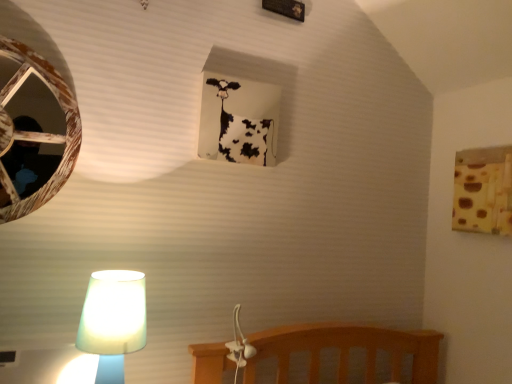
Question: Considering the relative sizes of wooden birdhouse at left and white paper at upper center, positioned as the 1th window frame in top-to-bottom order, in the image provided, is wooden birdhouse at left thinner than white paper at upper center, positioned as the 1th window frame in top-to-bottom order,?

Choices:
 (A) no
 (B) yes

Answer: (B)

Question: Does wooden birdhouse at left have a greater width compared to white paper at upper center, the second window frame from the right?

Choices:
 (A) no
 (B) yes

Answer: (A)

Question: Is wooden birdhouse at left located outside white paper at upper center, positioned as the 1th window frame in top-to-bottom order?

Choices:
 (A) yes
 (B) no

Answer: (A)

Question: From a real-world perspective, is wooden birdhouse at left positioned under white paper at upper center, the first window frame positioned from the left, based on gravity?

Choices:
 (A) yes
 (B) no

Answer: (A)

Question: From a real-world perspective, is wooden birdhouse at left physically above white paper at upper center, the first window frame positioned from the left?

Choices:
 (A) no
 (B) yes

Answer: (A)

Question: Looking at their shapes, would you say brown textured fabric at upper right, the first window frame positioned from the bottom, is wider or thinner than white paper at upper center, positioned as the 1th window frame in top-to-bottom order?

Choices:
 (A) wide
 (B) thin

Answer: (B)

Question: From their relative heights in the image, would you say brown textured fabric at upper right, the 2th window frame from the left, is taller or shorter than white paper at upper center, the first window frame positioned from the left?

Choices:
 (A) short
 (B) tall

Answer: (B)

Question: From the image's perspective, is brown textured fabric at upper right, the first window frame positioned from the bottom, above or below white paper at upper center, positioned as the 1th window frame in top-to-bottom order?

Choices:
 (A) below
 (B) above

Answer: (A)

Question: Considering the positions of point (506, 208) and point (251, 66), is point (506, 208) closer or farther from the camera than point (251, 66)?

Choices:
 (A) closer
 (B) farther

Answer: (A)

Question: In terms of width, does translucent glass lamp at lower left look wider or thinner when compared to white paper at upper center, positioned as the 1th window frame in top-to-bottom order?

Choices:
 (A) wide
 (B) thin

Answer: (A)

Question: Would you say translucent glass lamp at lower left is inside or outside white paper at upper center, positioned as the 1th window frame in top-to-bottom order?

Choices:
 (A) outside
 (B) inside

Answer: (A)

Question: In terms of height, does translucent glass lamp at lower left look taller or shorter compared to white paper at upper center, the second window frame from the right?

Choices:
 (A) tall
 (B) short

Answer: (B)

Question: Considering the positions of translucent glass lamp at lower left and white paper at upper center, the second window frame from the bottom, in the image, is translucent glass lamp at lower left bigger or smaller than white paper at upper center, the second window frame from the bottom,?

Choices:
 (A) big
 (B) small

Answer: (A)

Question: Considering the positions of point [266, 99] and point [35, 117], is point [266, 99] closer or farther from the camera than point [35, 117]?

Choices:
 (A) closer
 (B) farther

Answer: (A)

Question: In terms of height, does white paper at upper center, positioned as the 1th window frame in top-to-bottom order, look taller or shorter compared to wooden birdhouse at left?

Choices:
 (A) short
 (B) tall

Answer: (A)